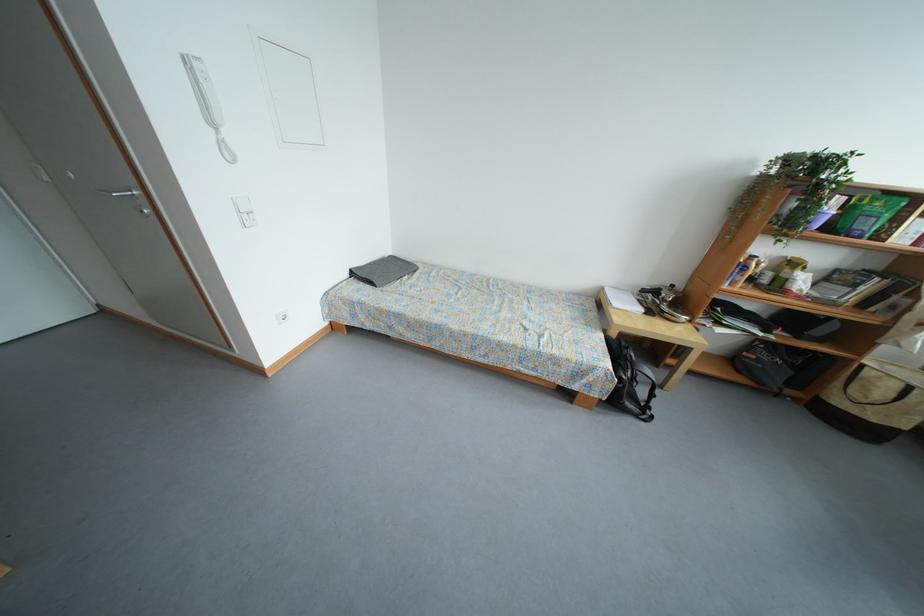
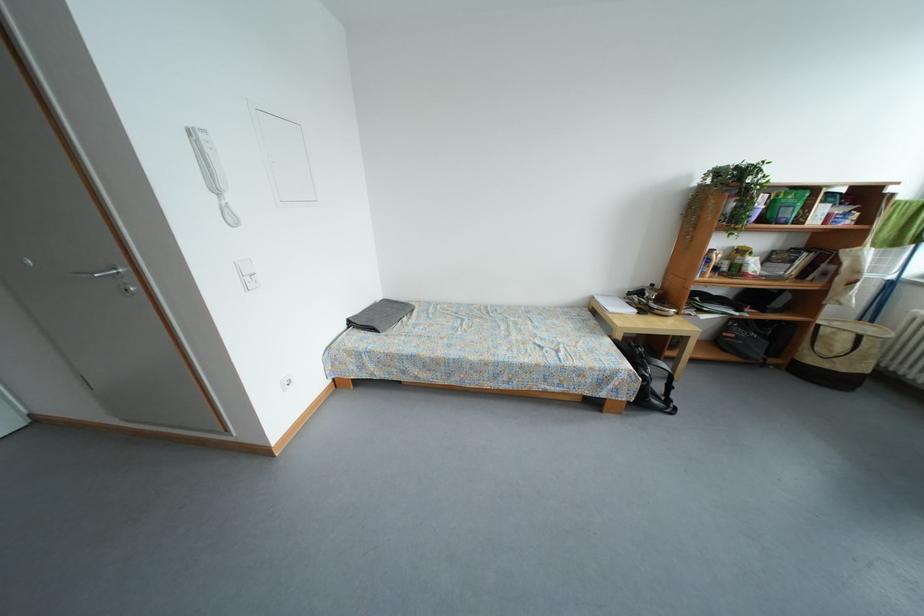
Question: Which direction would the cameraman need to move to produce the second image? Reply with the corresponding letter.

Choices:
 (A) Left
 (B) Right
 (C) Forward
 (D) Backward

Answer: (A)